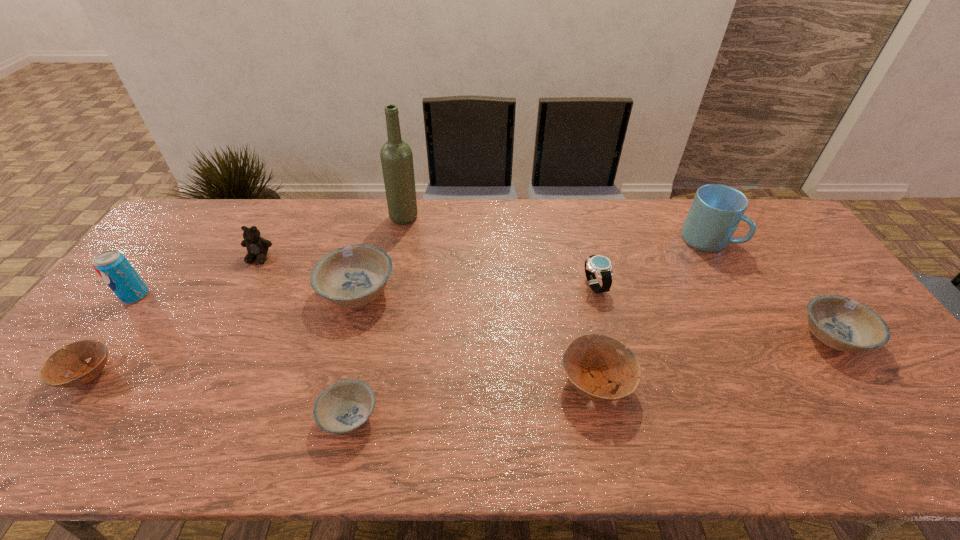
Identify the location of object located in the right edge section of the desktop. The image size is (960, 540). (841, 323).

What are the coordinates of `vacant space at the far edge` in the screenshot? It's located at (255, 210).

Where is `vacant space at the near edge`? This screenshot has width=960, height=540. vacant space at the near edge is located at coordinates (816, 446).

In the image, there is a desktop. Where is `vacant area at the left edge`? The width and height of the screenshot is (960, 540). vacant area at the left edge is located at coordinates (62, 389).

Locate an element on the screen. free space at the right edge of the desktop is located at coordinates (875, 376).

At what (x,y) coordinates should I click in order to perform the action: click on free area in between the mug and the brown teddy bear. Please return your answer as a coordinate pair (x, y). The width and height of the screenshot is (960, 540). Looking at the image, I should click on (483, 249).

This screenshot has width=960, height=540. I want to click on free space that is in between the watch and the biggest blue bowl, so click(x=475, y=289).

The width and height of the screenshot is (960, 540). Find the location of `free spot between the rightmost bowl and the left brown bowl`. free spot between the rightmost bowl and the left brown bowl is located at coordinates (460, 356).

Where is `free space between the leftmost bowl and the seventh shortest object`? The height and width of the screenshot is (540, 960). free space between the leftmost bowl and the seventh shortest object is located at coordinates (174, 316).

Image resolution: width=960 pixels, height=540 pixels. What are the coordinates of `vacant area between the second object from right to left and the seventh shortest object` in the screenshot? It's located at (483, 249).